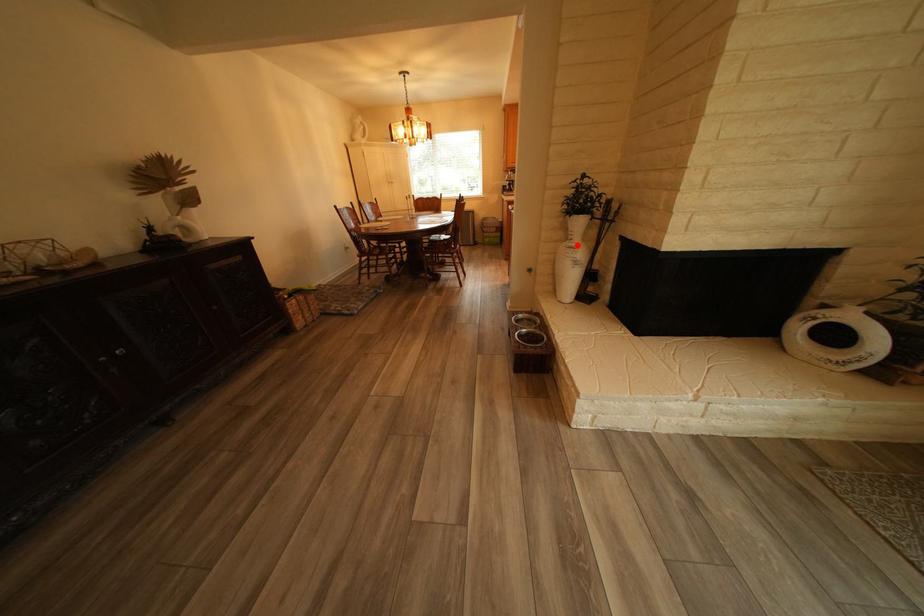
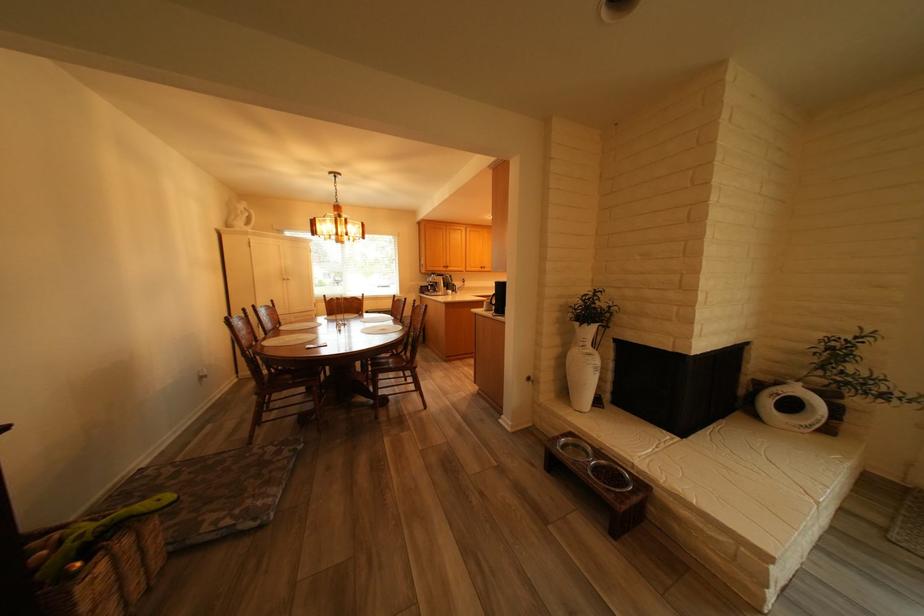
Question: I am providing you with two images of the same scene from different viewpoints. In image1, a red point is highlighted. Considering the same 3D point in image2, which of the following is correct?

Choices:
 (A) It is closer
 (B) It is farther

Answer: (B)